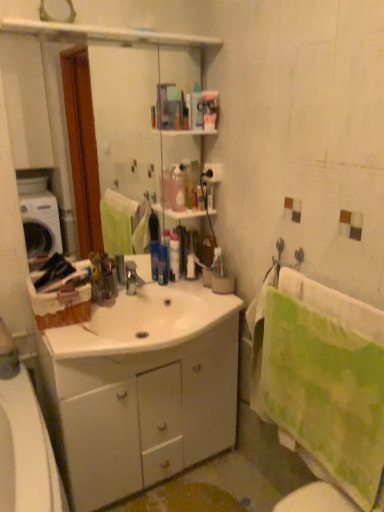
Question: Is clear glass mirror at upper center smaller than translucent plastic bottle at center, arranged as the 2th toiletry when viewed from the left?

Choices:
 (A) yes
 (B) no

Answer: (B)

Question: Does clear glass mirror at upper center appear on the left side of translucent plastic bottle at center, arranged as the 2th toiletry when viewed from the left?

Choices:
 (A) no
 (B) yes

Answer: (B)

Question: Is clear glass mirror at upper center placed right next to translucent plastic bottle at center, arranged as the 2th toiletry when viewed from the left?

Choices:
 (A) no
 (B) yes

Answer: (A)

Question: From a real-world perspective, is clear glass mirror at upper center located higher than translucent plastic bottle at center, which is the third toiletry in right-to-left order?

Choices:
 (A) yes
 (B) no

Answer: (A)

Question: Is clear glass mirror at upper center positioned beyond the bounds of translucent plastic bottle at center, arranged as the 2th toiletry when viewed from the left?

Choices:
 (A) yes
 (B) no

Answer: (A)

Question: In terms of width, does green textured towel at right look wider or thinner when compared to translucent plastic container at center, which appears as the 3th toiletry when viewed from the left?

Choices:
 (A) wide
 (B) thin

Answer: (A)

Question: Is point (271, 369) closer or farther from the camera than point (193, 256)?

Choices:
 (A) farther
 (B) closer

Answer: (B)

Question: From a real-world perspective, is green textured towel at right positioned above or below translucent plastic container at center, which appears as the 3th toiletry when viewed from the left?

Choices:
 (A) below
 (B) above

Answer: (A)

Question: Relative to translucent plastic container at center, which appears as the 3th toiletry when viewed from the left, is green textured towel at right in front or behind?

Choices:
 (A) behind
 (B) front

Answer: (B)

Question: Is translucent plastic bottle at center, which is the third toiletry in right-to-left order, spatially inside green textured towel at right, or outside of it?

Choices:
 (A) outside
 (B) inside

Answer: (A)

Question: Looking at the image, does translucent plastic bottle at center, which is the third toiletry in right-to-left order, seem bigger or smaller compared to green textured towel at right?

Choices:
 (A) small
 (B) big

Answer: (A)

Question: In the image, is translucent plastic bottle at center, which is the third toiletry in right-to-left order, positioned in front of or behind green textured towel at right?

Choices:
 (A) behind
 (B) front

Answer: (A)

Question: From the image's perspective, is translucent plastic bottle at center, arranged as the 2th toiletry when viewed from the left, positioned above or below green textured towel at right?

Choices:
 (A) below
 (B) above

Answer: (B)

Question: Does point (261, 344) appear closer or farther from the camera than point (218, 251)?

Choices:
 (A) closer
 (B) farther

Answer: (A)

Question: Is green textured towel at right in front of or behind translucent plastic toothbrush at upper center, acting as the fourth toiletry starting from the left, in the image?

Choices:
 (A) behind
 (B) front

Answer: (B)